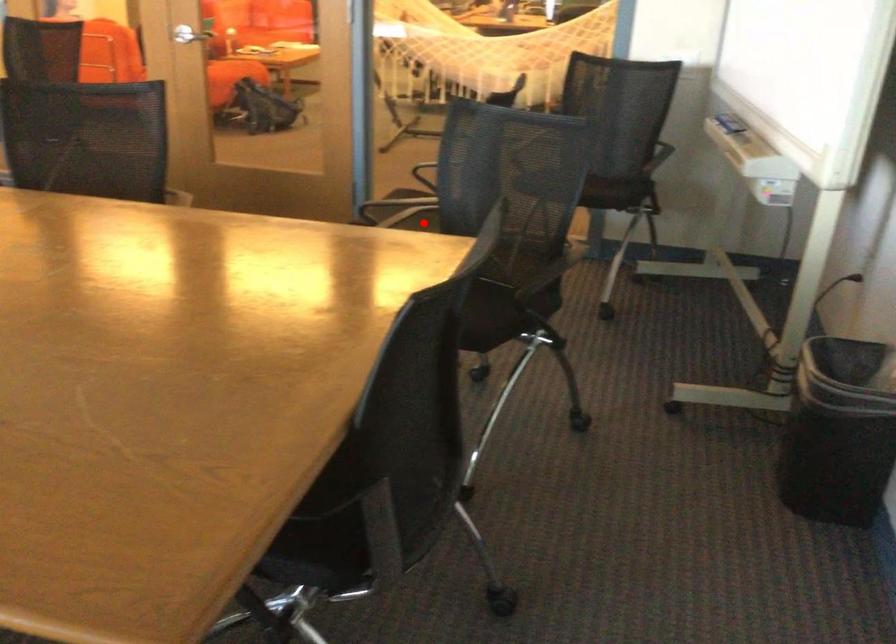
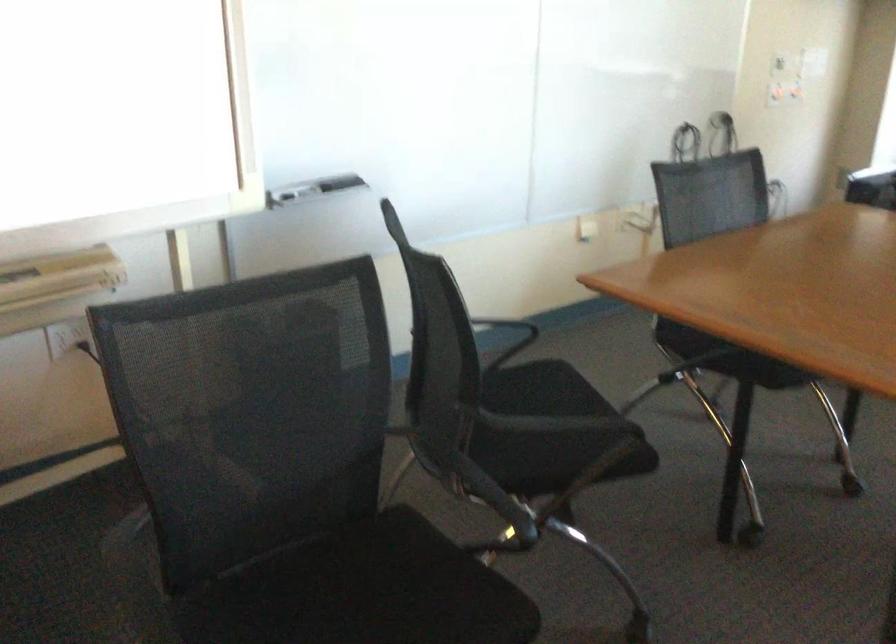
Locate, in the second image, the point that corresponds to the highlighted location in the first image.

(363, 592)